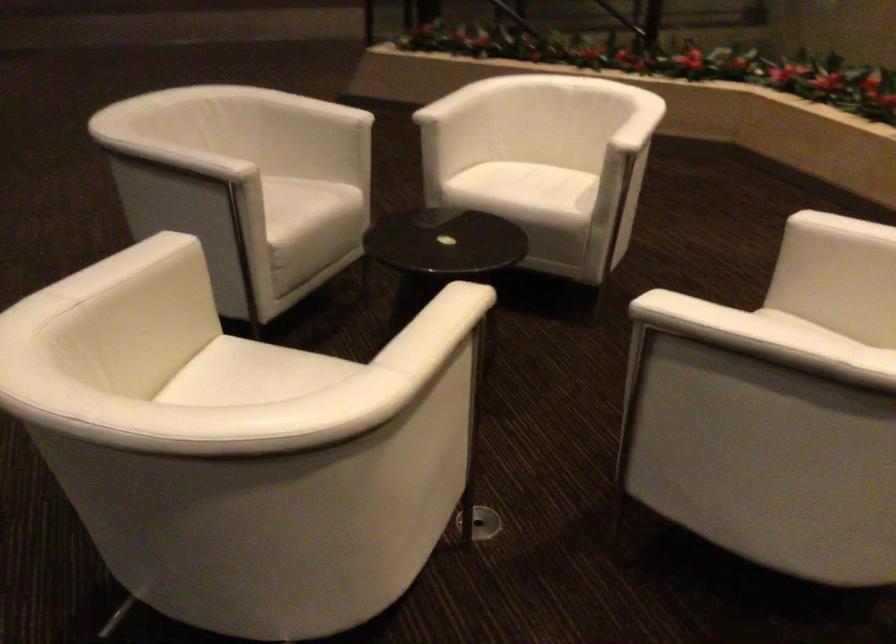
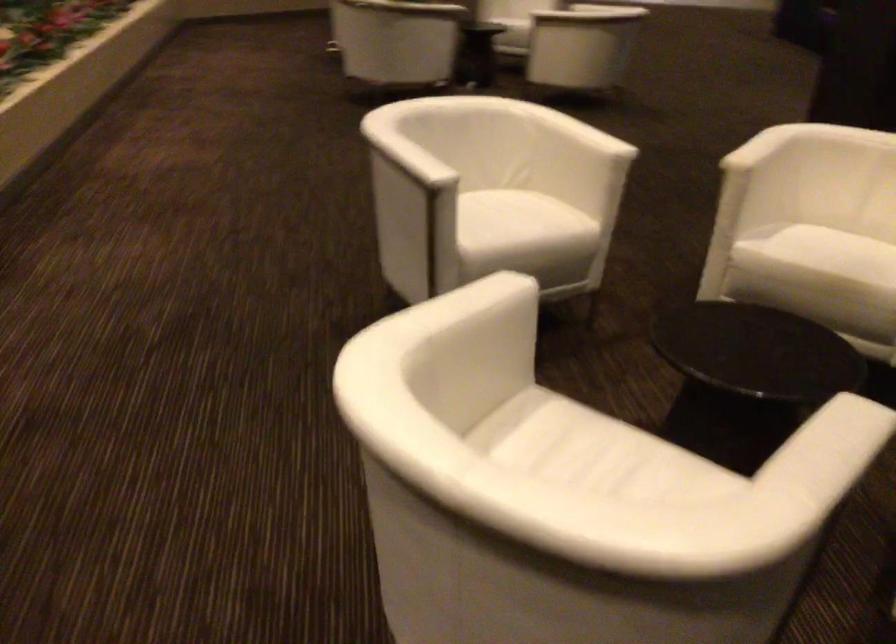
In the second image, find the point that corresponds to pixel 519 182 in the first image.

(616, 462)